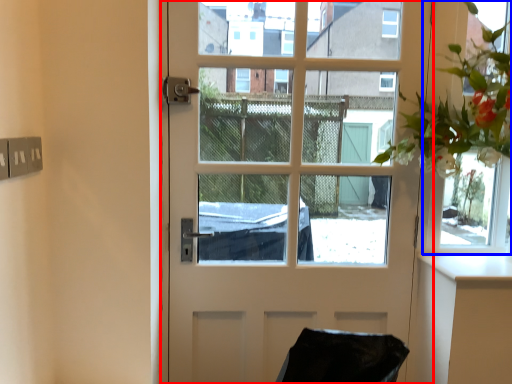
Question: Among these objects, which one is nearest to the camera, door (highlighted by a red box) or window frame (highlighted by a blue box)?

Choices:
 (A) door
 (B) window frame

Answer: (A)